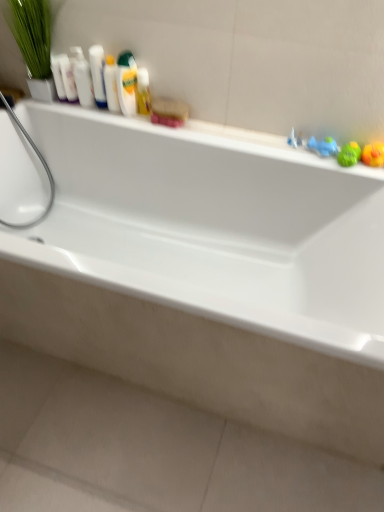
Question: Is green rubber duck at right, placed as the 2th toy when sorted from right to left, shorter than white glossy mouthwash at upper left, the third mouthwash when ordered from left to right?

Choices:
 (A) no
 (B) yes

Answer: (B)

Question: Is green rubber duck at right, which is the 2th toy from left to right, facing away from white glossy mouthwash at upper left, acting as the fourth mouthwash starting from the right?

Choices:
 (A) no
 (B) yes

Answer: (A)

Question: Is white glossy mouthwash at upper left, acting as the fourth mouthwash starting from the right, surrounded by green rubber duck at right, which is the 2th toy from left to right?

Choices:
 (A) no
 (B) yes

Answer: (A)

Question: Does green rubber duck at right, which is the 2th toy from left to right, appear on the right side of white glossy mouthwash at upper left, acting as the fourth mouthwash starting from the right?

Choices:
 (A) yes
 (B) no

Answer: (A)

Question: From the image's perspective, is green rubber duck at right, placed as the 2th toy when sorted from right to left, below white glossy mouthwash at upper left, acting as the fourth mouthwash starting from the right?

Choices:
 (A) no
 (B) yes

Answer: (B)

Question: Is white glossy bottles at upper left bigger or smaller than green leafy plant at upper left?

Choices:
 (A) small
 (B) big

Answer: (A)

Question: Is point (92, 89) positioned closer to the camera than point (9, 26)?

Choices:
 (A) closer
 (B) farther

Answer: (B)

Question: From a real-world perspective, is white glossy bottles at upper left above or below green leafy plant at upper left?

Choices:
 (A) above
 (B) below

Answer: (B)

Question: Which is correct: white glossy bottles at upper left is inside green leafy plant at upper left, or outside of it?

Choices:
 (A) inside
 (B) outside

Answer: (B)

Question: Does point (89, 99) appear closer or farther from the camera than point (309, 142)?

Choices:
 (A) closer
 (B) farther

Answer: (B)

Question: In terms of size, does white glossy mouthwash at upper left, the third mouthwash when ordered from left to right, appear bigger or smaller than blue rubber duck at upper right, the 3th toy viewed from the right?

Choices:
 (A) small
 (B) big

Answer: (B)

Question: Is white glossy mouthwash at upper left, acting as the fourth mouthwash starting from the right, to the left or to the right of blue rubber duck at upper right, marked as the first toy in a left-to-right arrangement, in the image?

Choices:
 (A) left
 (B) right

Answer: (A)

Question: In terms of height, does white glossy mouthwash at upper left, acting as the fourth mouthwash starting from the right, look taller or shorter compared to blue rubber duck at upper right, marked as the first toy in a left-to-right arrangement?

Choices:
 (A) short
 (B) tall

Answer: (B)

Question: In terms of size, does yellow rubber duck at upper right, which appears as the third toy when viewed from the left, appear bigger or smaller than white glossy ledge at upper center?

Choices:
 (A) small
 (B) big

Answer: (A)

Question: Does point (379, 150) appear closer or farther from the camera than point (254, 134)?

Choices:
 (A) farther
 (B) closer

Answer: (B)